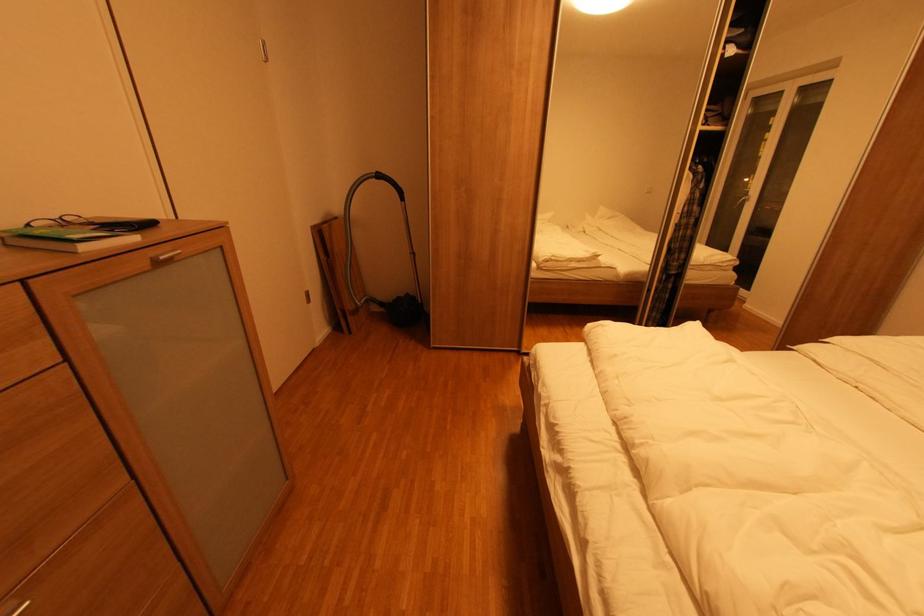
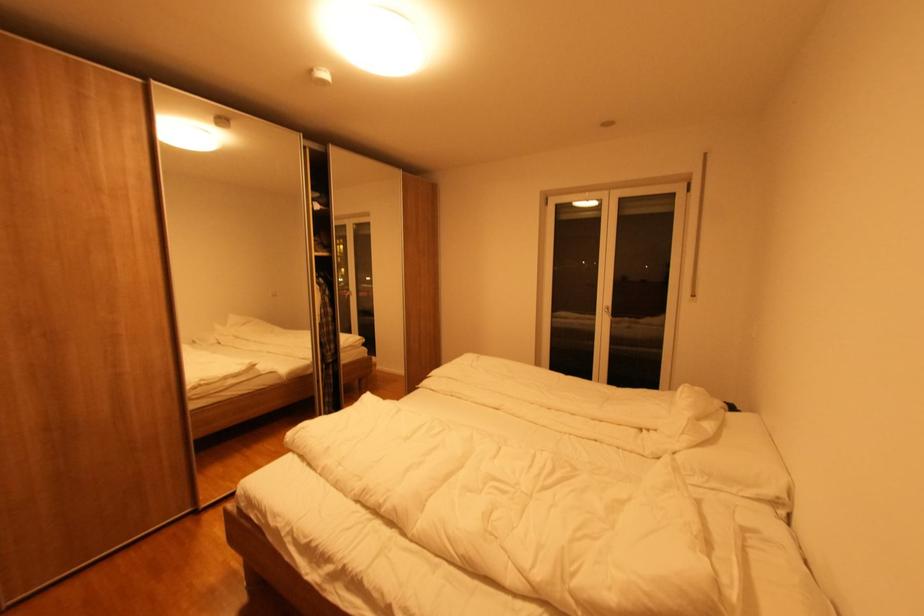
Question: The camera is either moving clockwise (left) or counter-clockwise (right) around the object. The first image is from the beginning of the video and the second image is from the end. Is the camera moving left or right when shooting the video?

Choices:
 (A) Left
 (B) Right

Answer: (A)